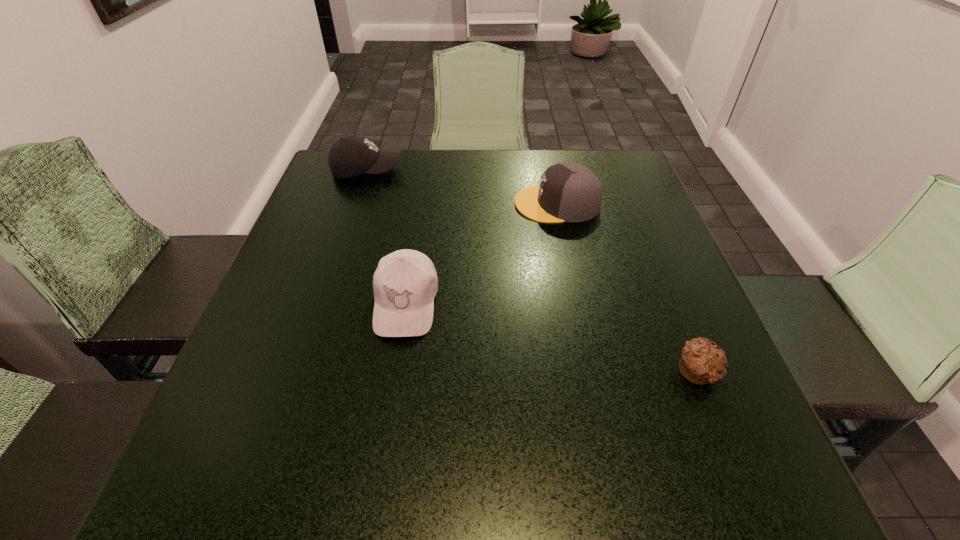
Identify the location of vacant space situated on the front-facing side of the third object from left to right. (435, 204).

Locate an element on the screen. The height and width of the screenshot is (540, 960). vacant area situated on the front-facing side of the third object from left to right is located at coordinates (387, 204).

The width and height of the screenshot is (960, 540). In order to click on vacant space located 0.250m on the front-facing side of the third object from right to left in this screenshot , I will do `click(376, 486)`.

In order to click on free location located 0.310m on the back of the shortest object in this screenshot , I will do `click(644, 239)`.

Image resolution: width=960 pixels, height=540 pixels. Find the location of `baseball cap that is at the far edge`. baseball cap that is at the far edge is located at coordinates (352, 155).

You are a GUI agent. You are given a task and a screenshot of the screen. Output one action in this format:
    pyautogui.click(x=<x>, y=<y>)
    Task: Click on the cap at the far edge
    
    Given the screenshot: What is the action you would take?
    pyautogui.click(x=568, y=192)

Where is `object located at the left edge`? The width and height of the screenshot is (960, 540). object located at the left edge is located at coordinates (352, 155).

The height and width of the screenshot is (540, 960). In order to click on cap present at the right edge in this screenshot , I will do `click(568, 192)`.

Where is `muffin that is at the right edge`? This screenshot has height=540, width=960. muffin that is at the right edge is located at coordinates (701, 362).

You are a GUI agent. You are given a task and a screenshot of the screen. Output one action in this format:
    pyautogui.click(x=<x>, y=<y>)
    Task: Click on the object that is at the far left corner
    The image size is (960, 540).
    Given the screenshot: What is the action you would take?
    pyautogui.click(x=352, y=155)